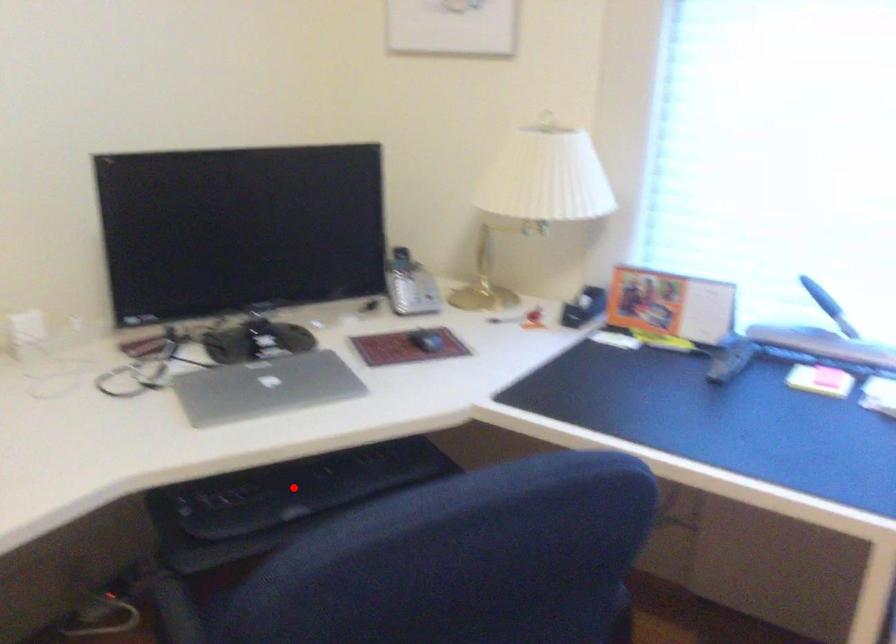
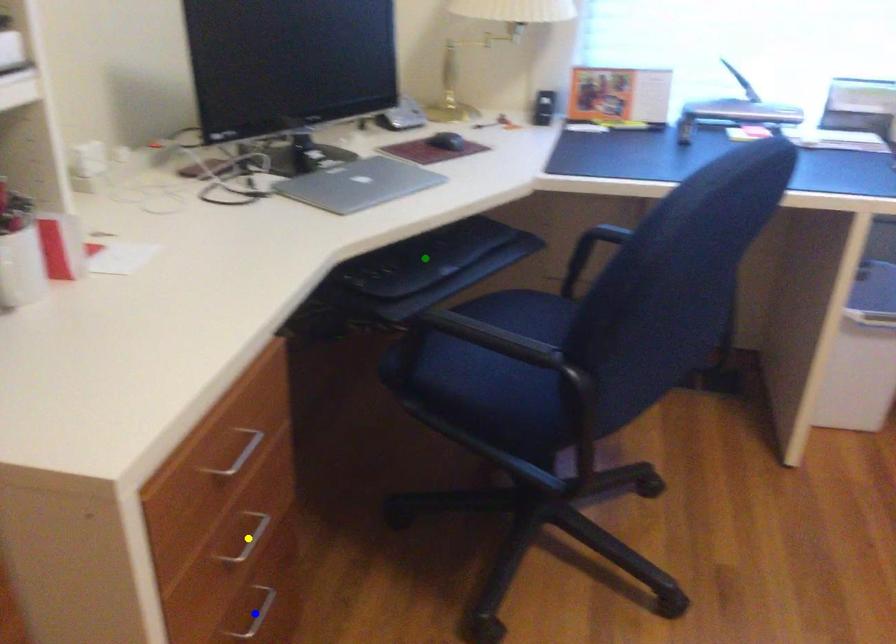
Question: I am providing you with two images of the same scene from different viewpoints. A red point is marked on the first image. You are given multiple points on the second image. Can you choose the point in image 2 that corresponds to the point in image 1?

Choices:
 (A) green point
 (B) blue point
 (C) yellow point

Answer: (A)